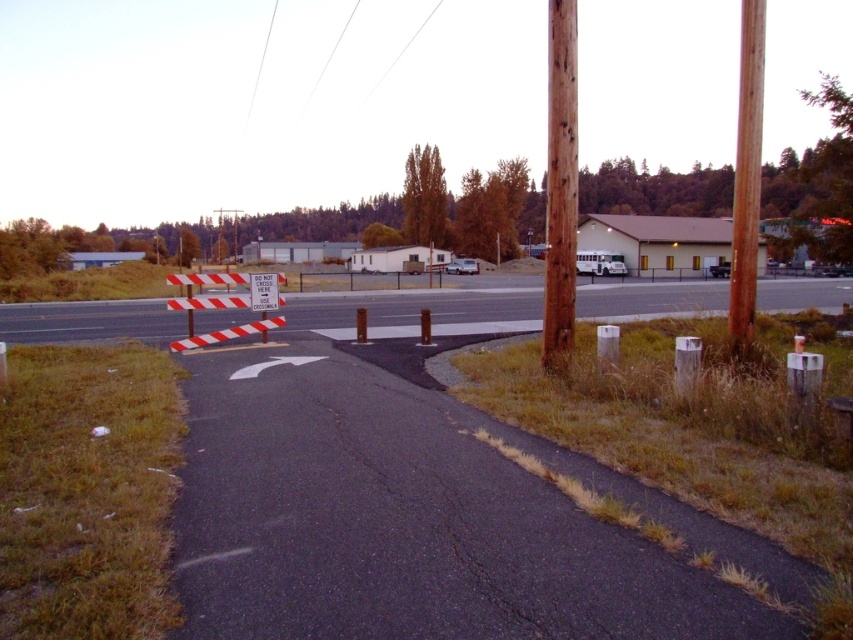
Between white striped barrier at center and white paper sign at center, which one has less height?

white paper sign at center

Who is lower down, white striped barrier at center or white paper sign at center?

white paper sign at center is lower down.

Does point (120, 307) come farther from viewer compared to point (252, 308)?

Yes, point (120, 307) is farther from viewer.

Where is `white striped barrier at center`? The width and height of the screenshot is (853, 640). white striped barrier at center is located at coordinates (421, 307).

Is point (453, 321) positioned behind point (552, 193)?

Yes, point (453, 321) is farther from viewer.

Where is `white striped barrier at center`? white striped barrier at center is located at coordinates (421, 307).

Which is more to the right, white striped barrier at center or brown wooden pole at right?

brown wooden pole at right is more to the right.

Describe the element at coordinates (421, 307) in the screenshot. I see `white striped barrier at center` at that location.

Locate an element on the screen. white striped barrier at center is located at coordinates (421, 307).

You are a GUI agent. You are given a task and a screenshot of the screen. Output one action in this format:
    pyautogui.click(x=<x>, y=<y>)
    Task: Click on the white striped barrier at center
    
    Given the screenshot: What is the action you would take?
    pyautogui.click(x=421, y=307)